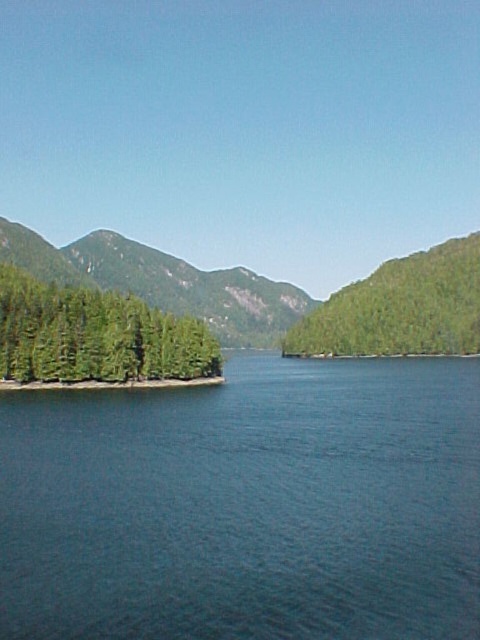
Question: Which object is the closest to the green matte trees at left?

Choices:
 (A) green matte tree at center-right
 (B) green forested mountain at left
 (C) blue water at center

Answer: (C)

Question: Can you confirm if green forested mountain at left is smaller than green matte tree at center-right?

Choices:
 (A) no
 (B) yes

Answer: (A)

Question: Which object is closer to the camera taking this photo?

Choices:
 (A) blue water at center
 (B) green matte tree at center-right
 (C) green matte trees at left
 (D) green forested mountain at left

Answer: (A)

Question: Which point appears closest to the camera in this image?

Choices:
 (A) (81, 579)
 (B) (365, 352)
 (C) (67, 339)

Answer: (A)

Question: From the image, what is the correct spatial relationship of blue water at center in relation to green forested mountain at left?

Choices:
 (A) below
 (B) above

Answer: (A)

Question: Is green matte trees at left in front of green forested mountain at left?

Choices:
 (A) no
 (B) yes

Answer: (B)